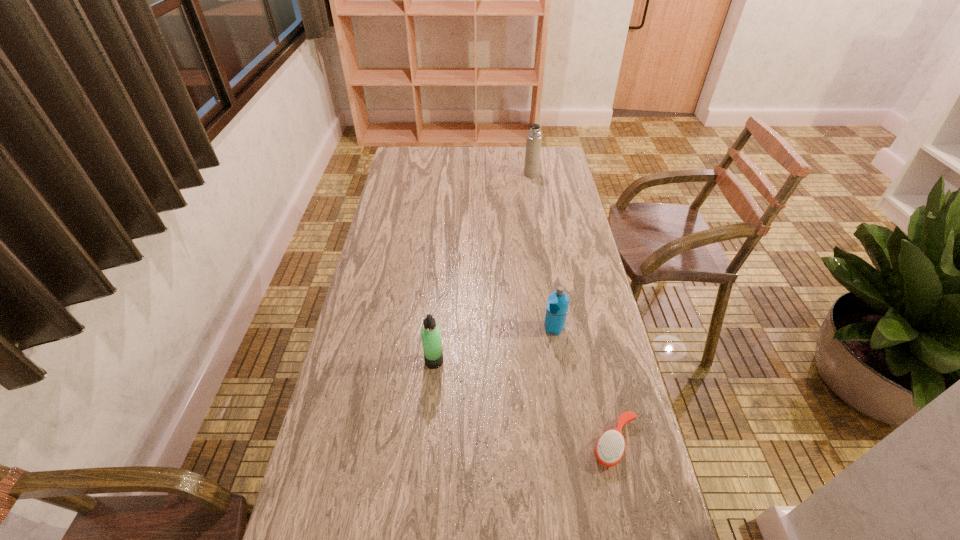
The width and height of the screenshot is (960, 540). Identify the location of the farthest object. (534, 138).

Locate an element on the screen. This screenshot has height=540, width=960. the tallest thermos bottle is located at coordinates (534, 138).

At what (x,y) coordinates should I click in order to perform the action: click on the leftmost object. Please return your answer as a coordinate pair (x, y). Looking at the image, I should click on (431, 337).

The height and width of the screenshot is (540, 960). What are the coordinates of `the second nearest object` in the screenshot? It's located at (431, 337).

Find the location of a particular element. The width and height of the screenshot is (960, 540). the second nearest thermos bottle is located at coordinates (557, 306).

Find the location of a particular element. the shortest object is located at coordinates (610, 447).

At what (x,y) coordinates should I click in order to perform the action: click on hairbrush. Please return your answer as a coordinate pair (x, y). Looking at the image, I should click on (610, 447).

Locate an element on the screen. free location located on the right of the tallest object is located at coordinates (564, 174).

Find the location of a particular element. The image size is (960, 540). vacant space located on the front of the leftmost thermos bottle is located at coordinates click(x=432, y=388).

Locate an element on the screen. free space located 0.230m on the left of the third nearest object is located at coordinates (468, 328).